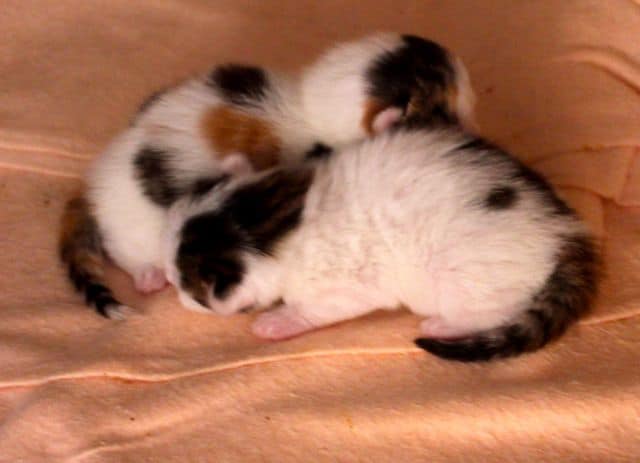
This screenshot has width=640, height=463. I want to click on fold in blanket, so click(x=118, y=375), click(x=348, y=350), click(x=61, y=151).